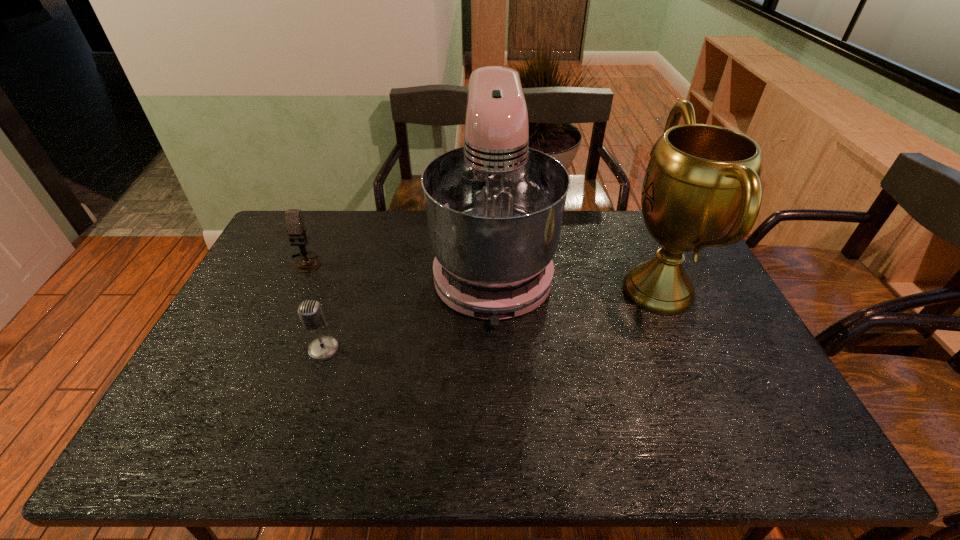
Image resolution: width=960 pixels, height=540 pixels. Find the location of `free location at the right edge of the desktop`. free location at the right edge of the desktop is located at coordinates coord(685,325).

Identify the location of vacant region at the far left corner of the desktop. Image resolution: width=960 pixels, height=540 pixels. (287, 237).

Image resolution: width=960 pixels, height=540 pixels. Identify the location of unoccupied position between the rightmost object and the second object from right to left. (575, 279).

Where is `free spot between the rightmost object and the mixer`? The width and height of the screenshot is (960, 540). free spot between the rightmost object and the mixer is located at coordinates (575, 279).

This screenshot has width=960, height=540. What are the coordinates of `unoccupied area between the mixer and the shortest object` in the screenshot? It's located at (408, 308).

In order to click on unoccupied area between the third object from left to right and the left microphone in this screenshot , I will do `click(399, 264)`.

Locate which object is the second closest to the trophy cup. Please provide its 2D coordinates. Your answer should be formatted as a tuple, i.e. [(x, y)], where the tuple contains the x and y coordinates of a point satisfying the conditions above.

[(310, 312)]

Image resolution: width=960 pixels, height=540 pixels. Find the location of `object identified as the second closest to the trophy cup`. object identified as the second closest to the trophy cup is located at coordinates (310, 312).

At what (x,y) coordinates should I click in order to perform the action: click on free region that satisfies the following two spatial constraints: 1. on the front-facing side of the shortest object; 2. on the left side of the leftmost object. Please return your answer as a coordinate pair (x, y). The height and width of the screenshot is (540, 960). Looking at the image, I should click on (266, 349).

This screenshot has height=540, width=960. Find the location of `free spot that satisfies the following two spatial constraints: 1. on the front-facing side of the left microphone; 2. on the left side of the right microphone`. free spot that satisfies the following two spatial constraints: 1. on the front-facing side of the left microphone; 2. on the left side of the right microphone is located at coordinates (266, 349).